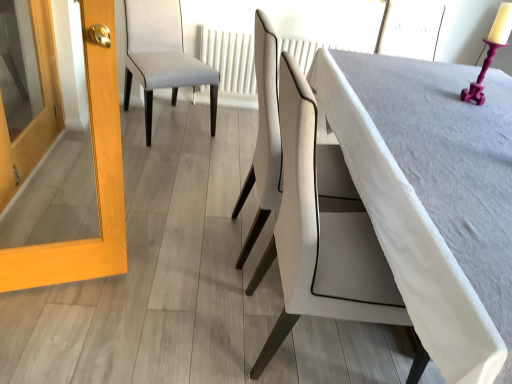
Question: Looking at their shapes, would you say white leather chair at center, the 2th chair in the left-to-right sequence, is wider or thinner than light wood frame at left?

Choices:
 (A) wide
 (B) thin

Answer: (A)

Question: Considering the positions of white leather chair at center, the 2th chair in the left-to-right sequence, and light wood frame at left in the image, is white leather chair at center, the 2th chair in the left-to-right sequence, bigger or smaller than light wood frame at left?

Choices:
 (A) big
 (B) small

Answer: (A)

Question: Which object is the closest to the smooth gray table at center?

Choices:
 (A) white textured radiator at center
 (B) light gray fabric chair at upper left, which appears as the second chair when viewed from the front
 (C) white leather chair at center, which is the first chair in front-to-back order
 (D) light wood frame at left

Answer: (C)

Question: Which of these objects is positioned farthest from the light gray fabric chair at upper left, the 1th chair viewed from the back?

Choices:
 (A) smooth gray table at center
 (B) light wood frame at left
 (C) white leather chair at center, the 2th chair in the left-to-right sequence
 (D) white textured radiator at center

Answer: (B)